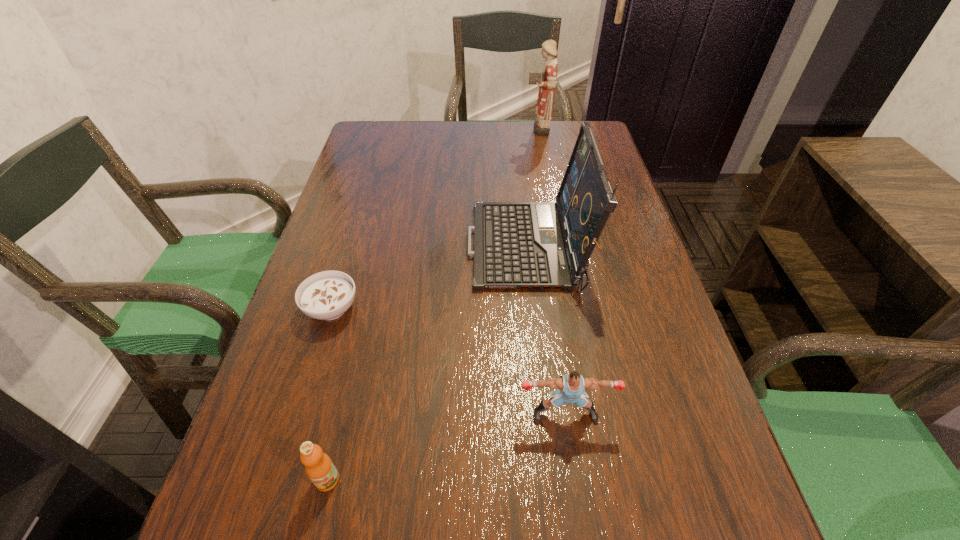
Image resolution: width=960 pixels, height=540 pixels. I want to click on empty location between the laptop computer and the figurine, so click(533, 188).

Where is `empty space between the soup bowl and the puncher`? The width and height of the screenshot is (960, 540). empty space between the soup bowl and the puncher is located at coordinates (448, 361).

Identify the location of free space between the orange juice and the shortest object. (329, 394).

The image size is (960, 540). Find the location of `empty space that is in between the figurine and the laptop computer`. empty space that is in between the figurine and the laptop computer is located at coordinates (533, 188).

This screenshot has height=540, width=960. What are the coordinates of `free space between the fourth farthest object and the laptop computer` in the screenshot? It's located at (546, 331).

Choose which object is the fourth nearest neighbor to the shortest object. Please provide its 2D coordinates. Your answer should be formatted as a tuple, i.e. [(x, y)], where the tuple contains the x and y coordinates of a point satisfying the conditions above.

[(546, 80)]

The image size is (960, 540). What are the coordinates of `object that stands as the fourth closest to the orange juice` in the screenshot? It's located at (546, 80).

I want to click on free point that satisfies the following two spatial constraints: 1. on the front-facing side of the farthest object; 2. on the front-facing side of the puncher, so click(x=590, y=414).

This screenshot has height=540, width=960. What are the coordinates of `vacant space that satisfies the following two spatial constraints: 1. on the front-facing side of the farthest object; 2. on the front label of the nearest object` in the screenshot? It's located at (603, 480).

Locate an element on the screen. vacant area that satisfies the following two spatial constraints: 1. on the front-facing side of the figurine; 2. on the front label of the orange juice is located at coordinates (603, 480).